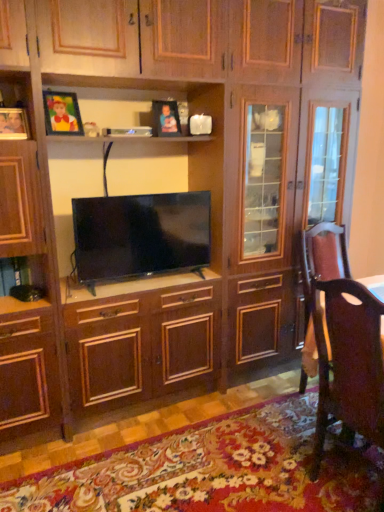
Locate an element on the screen. free space behind brown leather chair at lower right is located at coordinates (293, 442).